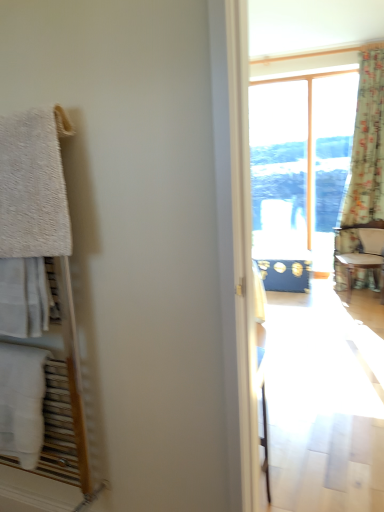
Question: Can you see wooden textured chair at right touching floral fabric curtain at right?

Choices:
 (A) no
 (B) yes

Answer: (A)

Question: Does wooden textured chair at right have a lesser height compared to floral fabric curtain at right?

Choices:
 (A) no
 (B) yes

Answer: (B)

Question: Is wooden textured chair at right positioned with its back to floral fabric curtain at right?

Choices:
 (A) no
 (B) yes

Answer: (B)

Question: Does wooden textured chair at right lie behind floral fabric curtain at right?

Choices:
 (A) no
 (B) yes

Answer: (A)

Question: Can you confirm if wooden textured chair at right is bigger than floral fabric curtain at right?

Choices:
 (A) no
 (B) yes

Answer: (A)

Question: Is wooden textured chair at right taller than floral fabric curtain at right?

Choices:
 (A) yes
 (B) no

Answer: (B)

Question: Is white cotton towel at left, the second towel/napkin when ordered from top to bottom, shorter than wooden textured chair at right?

Choices:
 (A) yes
 (B) no

Answer: (A)

Question: Does white cotton towel at left, the first towel/napkin when ordered from bottom to top, lie behind wooden textured chair at right?

Choices:
 (A) no
 (B) yes

Answer: (A)

Question: Is white cotton towel at left, the first towel/napkin when ordered from bottom to top, oriented away from wooden textured chair at right?

Choices:
 (A) no
 (B) yes

Answer: (B)

Question: From a real-world perspective, is white cotton towel at left, the second towel/napkin when ordered from top to bottom, on top of wooden textured chair at right?

Choices:
 (A) yes
 (B) no

Answer: (A)

Question: From a real-world perspective, is white cotton towel at left, the first towel/napkin when ordered from bottom to top, below wooden textured chair at right?

Choices:
 (A) no
 (B) yes

Answer: (A)

Question: Are white cotton towel at left, the first towel/napkin when ordered from bottom to top, and wooden textured chair at right far apart?

Choices:
 (A) no
 (B) yes

Answer: (B)

Question: Considering the relative sizes of white fluffy towel at left, placed as the first towel/napkin when sorted from top to bottom, and white cotton towel at left, the second towel/napkin when ordered from top to bottom, in the image provided, is white fluffy towel at left, placed as the first towel/napkin when sorted from top to bottom, shorter than white cotton towel at left, the second towel/napkin when ordered from top to bottom,?

Choices:
 (A) yes
 (B) no

Answer: (B)